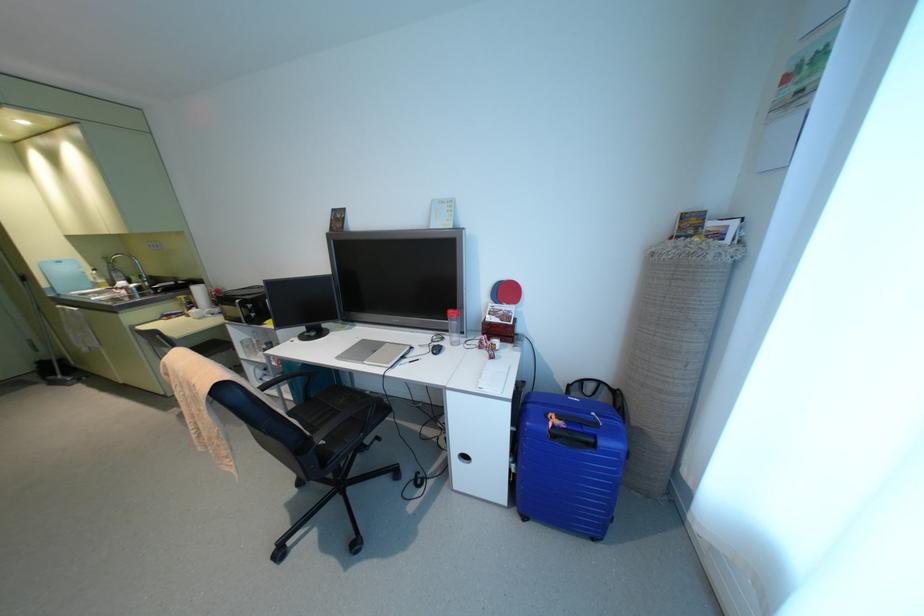
The image size is (924, 616). What do you see at coordinates (361, 416) in the screenshot?
I see `the black chair armrest` at bounding box center [361, 416].